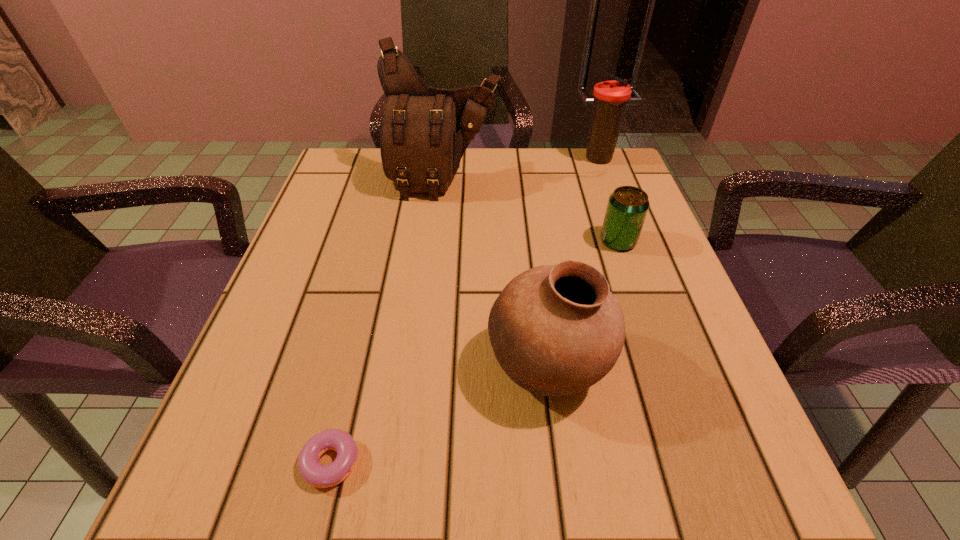
Locate an element on the screen. This screenshot has width=960, height=540. free point between the second shortest object and the shortest object is located at coordinates (471, 352).

Find the location of a particular element. Image resolution: width=960 pixels, height=540 pixels. vacant area that lies between the nearest object and the beer can is located at coordinates (471, 352).

The width and height of the screenshot is (960, 540). I want to click on free space between the second shortest object and the tallest object, so click(x=531, y=212).

Locate an element on the screen. This screenshot has height=540, width=960. vacant area that lies between the doughnut and the pottery is located at coordinates (436, 415).

At what (x,y) coordinates should I click in order to perform the action: click on vacant area between the pottery and the nearest object. Please return your answer as a coordinate pair (x, y). The width and height of the screenshot is (960, 540). Looking at the image, I should click on (436, 415).

Image resolution: width=960 pixels, height=540 pixels. Find the location of `the second closest object to the tallest object`. the second closest object to the tallest object is located at coordinates (627, 208).

This screenshot has height=540, width=960. I want to click on object that stands as the third closest to the shoulder bag, so click(556, 330).

Image resolution: width=960 pixels, height=540 pixels. I want to click on blank area in the image that satisfies the following two spatial constraints: 1. on the front-facing side of the shoulder bag; 2. on the left side of the second nearest object, so click(x=423, y=367).

The image size is (960, 540). I want to click on free location that satisfies the following two spatial constraints: 1. on the front-facing side of the beer can; 2. on the left side of the tallest object, so click(437, 241).

Locate an element on the screen. The height and width of the screenshot is (540, 960). free spot that satisfies the following two spatial constraints: 1. on the back side of the beer can; 2. on the left side of the pottery is located at coordinates (532, 241).